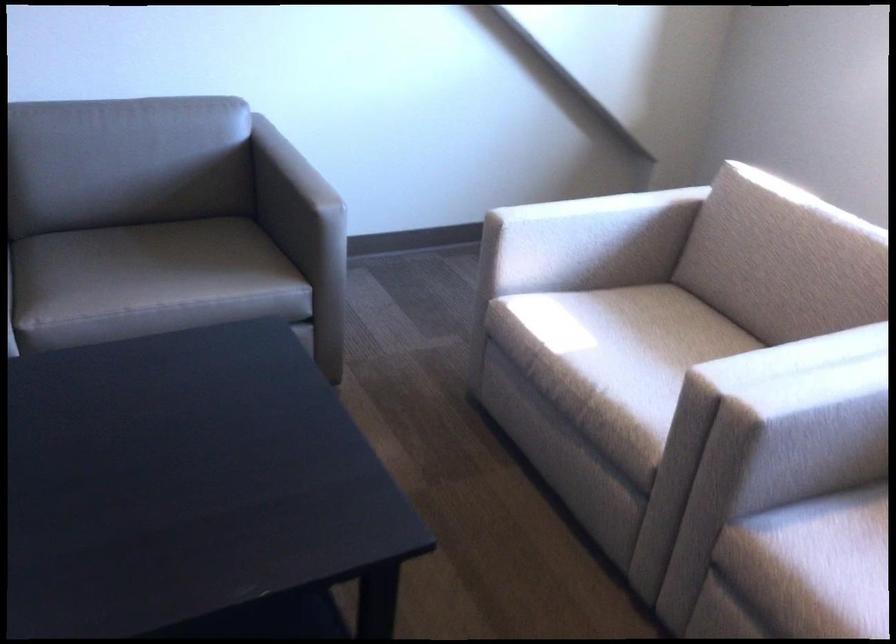
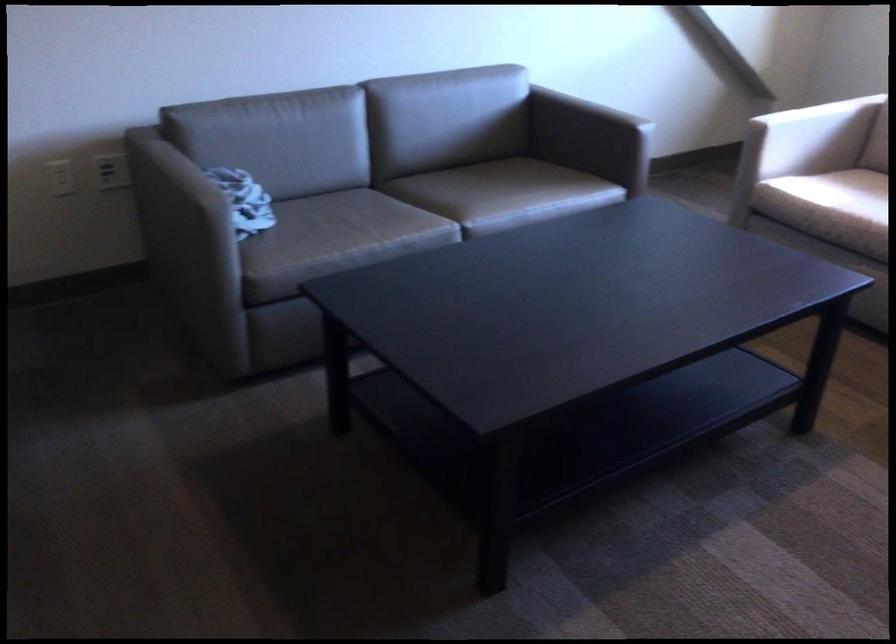
Where in the second image is the point corresponding to pixel 624 245 from the first image?

(824, 137)